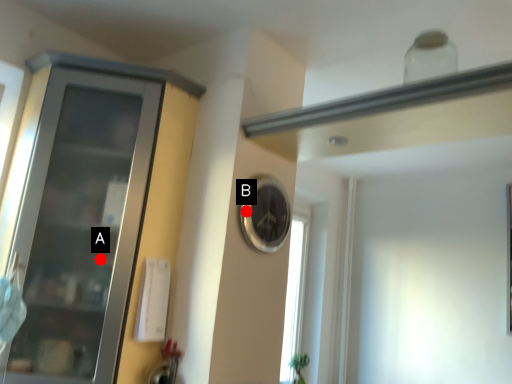
Question: Two points are circled on the image, labeled by A and B beside each circle. Which point is farther to the camera?

Choices:
 (A) A is further
 (B) B is further

Answer: (B)